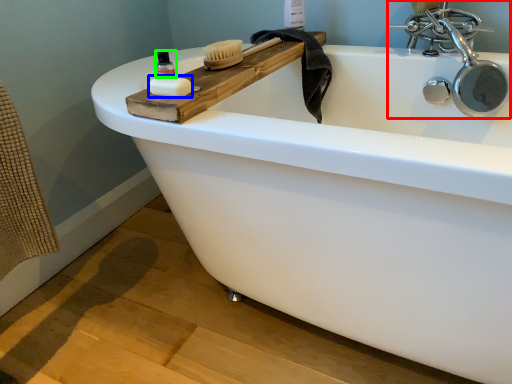
Question: Which object is the closest to the tap (highlighted by a red box)? Choose among these: soap (highlighted by a blue box) or mouthwash (highlighted by a green box).

Choices:
 (A) soap
 (B) mouthwash

Answer: (B)